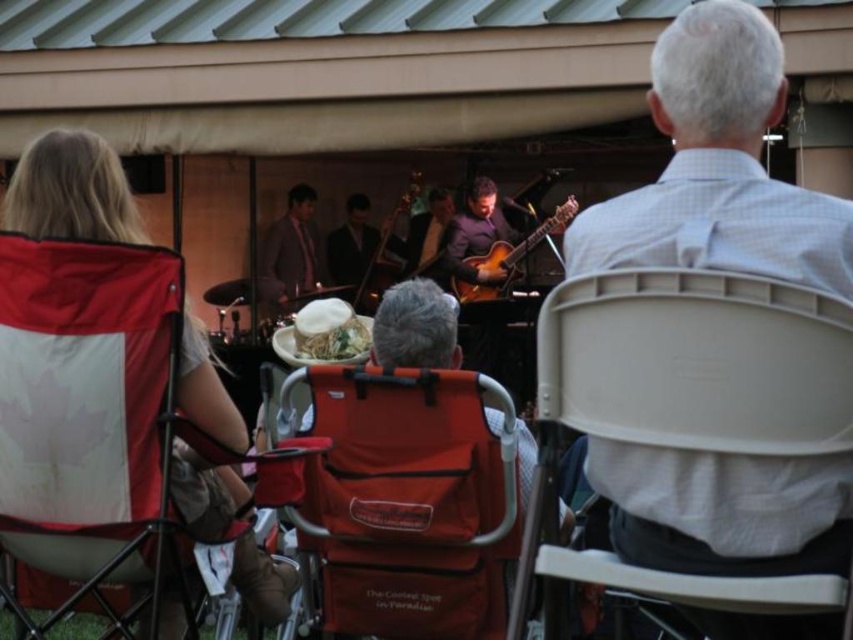
Which is below, red fabric chair at left or shiny brown suit at center?

red fabric chair at left is lower down.

Is red fabric chair at left shorter than shiny brown suit at center?

Correct, red fabric chair at left is not as tall as shiny brown suit at center.

Is point (65, 148) in front of point (260, 256)?

That is True.

The image size is (853, 640). Find the location of `red fabric chair at left`. red fabric chair at left is located at coordinates (71, 192).

Is matte red folding chair at center behind white paper plate at center?

No, matte red folding chair at center is closer to the viewer.

Find the location of a particular element. The height and width of the screenshot is (640, 853). matte red folding chair at center is located at coordinates (407, 500).

Is white plastic chair at right wider than glossy wood guitar at center?

Incorrect, white plastic chair at right's width does not surpass glossy wood guitar at center's.

The image size is (853, 640). I want to click on white plastic chair at right, so click(x=697, y=362).